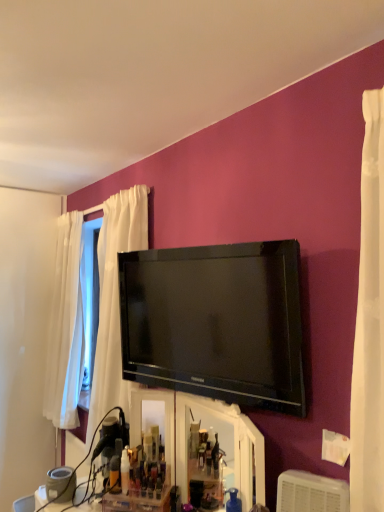
Question: In terms of width, does translucent plastic bottle at center look wider or thinner when compared to black glossy tv at upper center?

Choices:
 (A) wide
 (B) thin

Answer: (B)

Question: Considering the positions of point (127, 488) and point (238, 369), is point (127, 488) closer or farther from the camera than point (238, 369)?

Choices:
 (A) farther
 (B) closer

Answer: (A)

Question: Which object is positioned closest to the translucent plastic bottle at center?

Choices:
 (A) white plastic air conditioner at lower right
 (B) black glossy tv at upper center

Answer: (B)

Question: Estimate the real-world distances between objects in this image. Which object is closer to the white plastic air conditioner at lower right?

Choices:
 (A) black glossy tv at upper center
 (B) translucent plastic bottle at center

Answer: (A)